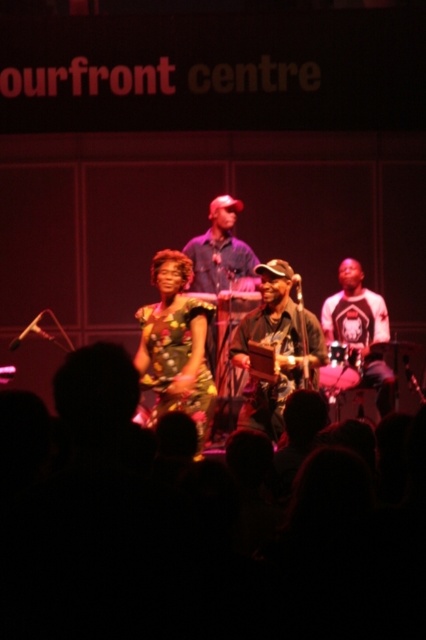
Consider the image. You are a photographer at the venue and need to frame a shot that includes both the printed fabric dress at center and the matte black guitar at center. Which object is narrower so that you can position it closer to the edge of the frame without cropping?

The printed fabric dress at center is narrower than the matte black guitar at center, so it can be positioned closer to the edge of the frame without cropping.

Consider the image. You are a photographer at the venue and need to capture a photo of the printed fabric dress at center and the matte black guitar at center for the program cover. The camera you are using has a limited depth of field. Which object should you focus on to ensure it appears sharp in the photo?

The printed fabric dress at center is much taller than the matte black guitar at center, so focusing on the printed fabric dress at center will ensure it appears sharp since it is larger in the frame.

Looking at this image, you are a photographer positioned at the center of the venue. You want to capture a photo that includes both the point at [149,353] and the point at [250,412]. Based on their positions, which point should you focus on first to ensure both are in frame?

Since point [149,353] is behind point [250,412], you should focus on point [250,412] first to ensure both are in frame.